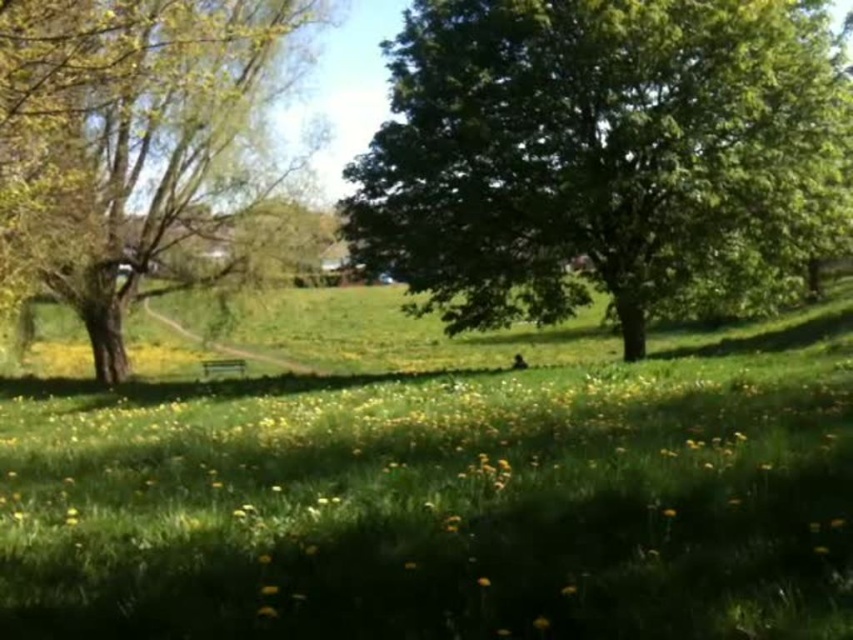
You are standing at the edge of the park and want to find a spot to place a picnic blanket. You see the green grass at center and the green leafy tree at center. Which area would provide shade from the sun?

The green grass at center is below the green leafy tree at center, so placing the picnic blanket there would provide shade from the tree.

You are a gardener standing at the entrance of the park and want to reach the green leafy tree at center to prune its branches. However, you notice the green grass at center in your path. Can you walk directly to the tree without stepping on the grass?

The green grass at center is in front of the green leafy tree at center, so you would have to walk through the green grass at center to reach the tree, meaning you would step on the grass.

You are a gardener who needs to mow the lawn. You are currently standing at the green leafy tree at left. Which direction should you go to reach the green grass at center?

The green grass at center is to the right of the green leafy tree at left, so you should go to the right to reach the green grass at center.